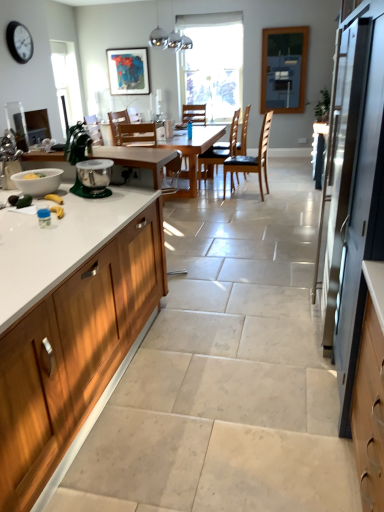
Question: Does point (119, 136) appear closer or farther from the camera than point (243, 146)?

Choices:
 (A) closer
 (B) farther

Answer: (A)

Question: Would you say wooden chair at center, the fifth chair when ordered from back to front, is inside or outside wooden chair at center, which ranks as the fourth chair in front-to-back order?

Choices:
 (A) inside
 (B) outside

Answer: (B)

Question: Which of these objects is positioned farthest from the brown leather chair at center, arranged as the 2th chair when viewed from the front?

Choices:
 (A) wooden chair at center, the second chair in the back-to-front sequence
 (B) wooden chair at center, which is the first chair in front-to-back order
 (C) white glossy bowl at left
 (D) green plastic stand mixer at left
 (E) light wood table at center

Answer: (C)

Question: Estimate the real-world distances between objects in this image. Which object is closer to the brown leather chair at center, the fourth chair viewed from the back?

Choices:
 (A) wooden cabinet at left
 (B) black plastic clock at upper left
 (C) clear glass window screen at upper right
 (D) wooden chair at center, the first chair positioned from the back
 (E) satin silver refrigerator at right

Answer: (D)